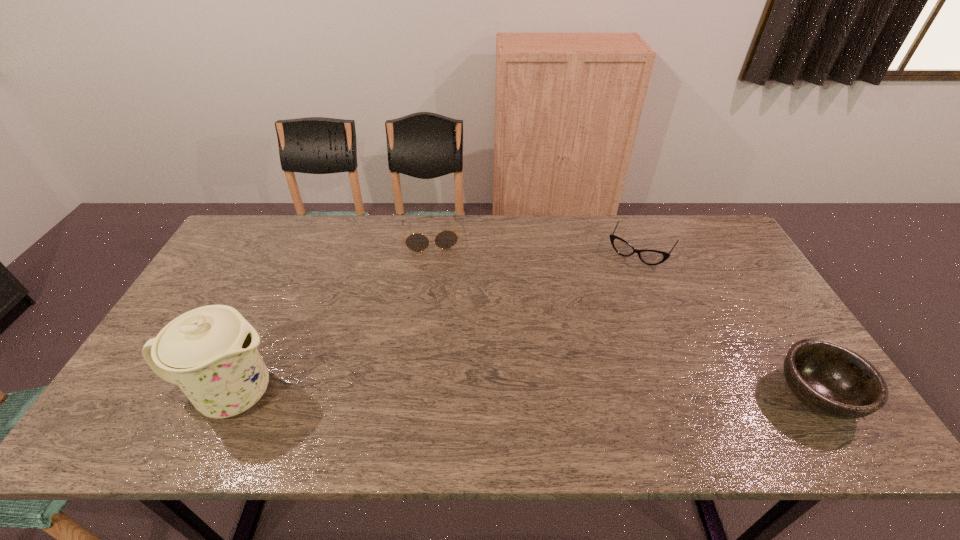
At what (x,y) coordinates should I click in order to perform the action: click on free spot on the desktop that is between the leftmost object and the third shortest object and is positioned on the front-facing side of the second object from right to left. Please return your answer as a coordinate pair (x, y). The width and height of the screenshot is (960, 540). Looking at the image, I should click on (560, 394).

Locate an element on the screen. vacant spot on the desktop that is between the chinaware and the rightmost object and is positioned on the lenses of the second object from left to right is located at coordinates (452, 394).